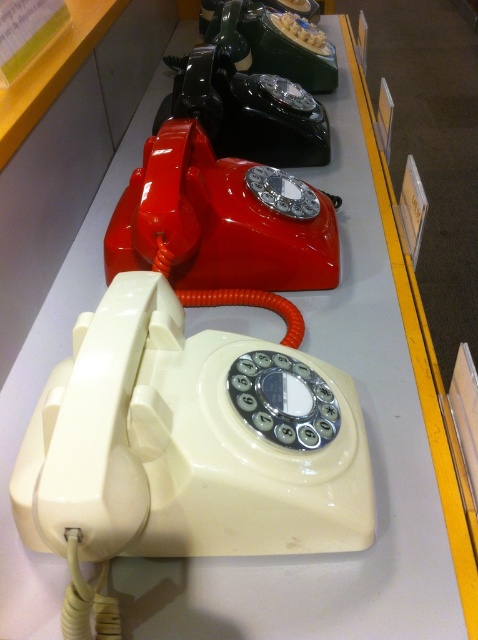
Question: Is the position of shiny red rotary phone at center more distant than that of shiny black rotary phone at center?

Choices:
 (A) yes
 (B) no

Answer: (B)

Question: Which object is the closest to the shiny red rotary phone at center?

Choices:
 (A) shiny black rotary phone at center
 (B) shiny black rotary phone at upper center

Answer: (A)

Question: Can you confirm if shiny black rotary phone at center is positioned below shiny black rotary phone at upper center?

Choices:
 (A) no
 (B) yes

Answer: (B)

Question: Is the position of shiny black rotary phone at center less distant than that of shiny black rotary phone at upper center?

Choices:
 (A) no
 (B) yes

Answer: (B)

Question: Which of the following is the farthest from the observer?

Choices:
 (A) (281, 166)
 (B) (318, 275)

Answer: (A)

Question: Estimate the real-world distances between objects in this image. Which object is closer to the shiny red rotary phone at center?

Choices:
 (A) shiny black rotary phone at center
 (B) shiny black rotary phone at upper center

Answer: (A)